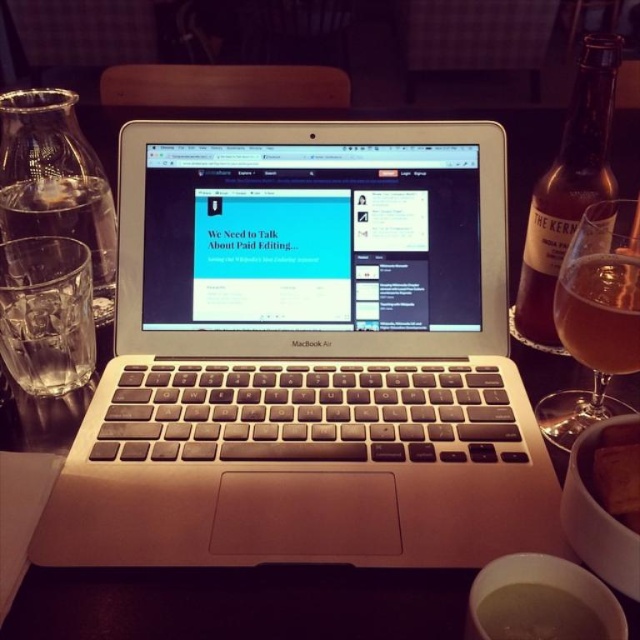
You are a photographer standing at the camera position. You want to focus on both point (244,339) and point (396,637) in the image. Which point should you focus on first to ensure both are in focus?

You should focus on point (244,339) first because it is closer to the camera than point (396,637). By focusing on the closer point, the depth of field may also keep the farther point in focus.

You are standing in front of the table and want to reach the point at coordinates (592, 177). Considering the objects on the table, can you estimate how far this point is from you?

The point at coordinates (592, 177) is 20.70 inches away from the viewer.

You are a person with a 16 inch long ruler. You want to measure the distance between yourself and the metallic silver laptop at center. Can you reach it with your ruler?

The metallic silver laptop at center and viewer are 14.08 inches apart from each other, so yes, the ruler can reach the distance since it is 16 inches long, which is longer than 14.08 inches.